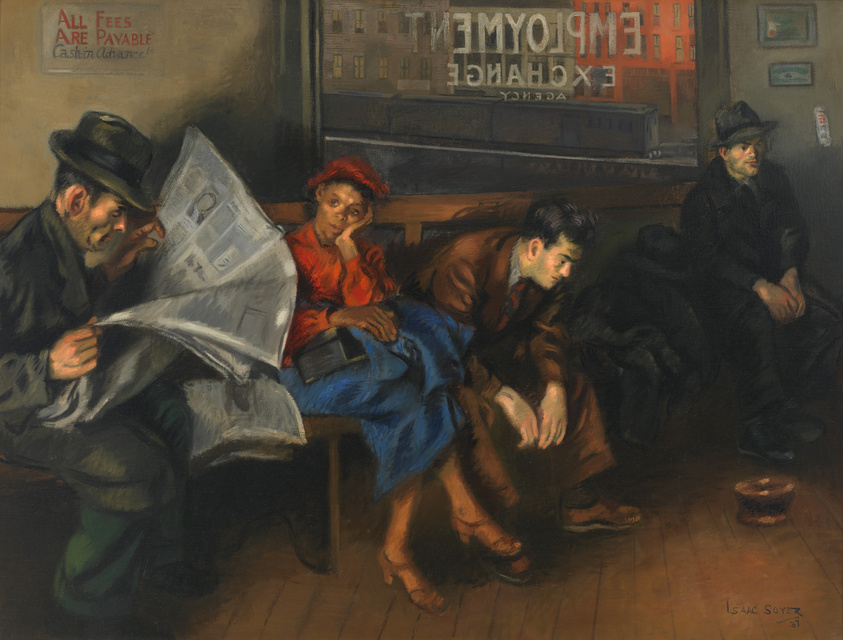
What are the coordinates of `floor` in the screenshot? It's located at (625, 566).